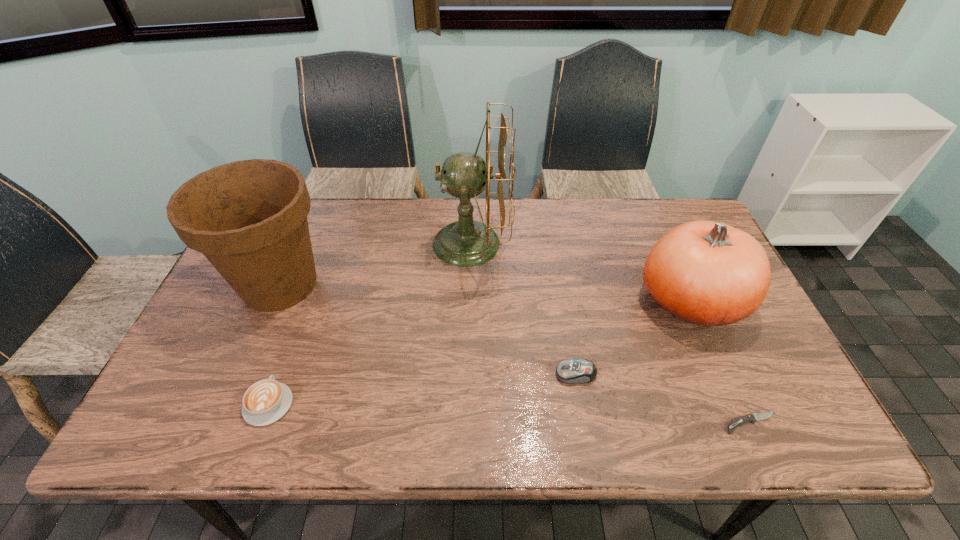
Where is `object that is positioned at the left edge`? The image size is (960, 540). object that is positioned at the left edge is located at coordinates (249, 218).

Identify the location of pumpkin present at the right edge. (706, 273).

Where is `pocketknife situated at the right edge`? Image resolution: width=960 pixels, height=540 pixels. pocketknife situated at the right edge is located at coordinates (754, 417).

Where is `object positioned at the near right corner`? object positioned at the near right corner is located at coordinates (754, 417).

This screenshot has width=960, height=540. Identify the location of vacant space at the far edge of the desktop. (617, 210).

The width and height of the screenshot is (960, 540). In the image, there is a desktop. What are the coordinates of `vacant space at the near edge` in the screenshot? It's located at (431, 429).

This screenshot has width=960, height=540. I want to click on free location at the right edge of the desktop, so click(754, 355).

Where is `unoccupied position between the flowerpot and the computer mouse`? The height and width of the screenshot is (540, 960). unoccupied position between the flowerpot and the computer mouse is located at coordinates (428, 329).

Locate an element on the screen. vacant region between the computer mouse and the flowerpot is located at coordinates (428, 329).

Where is `free space between the cappuccino and the fourth object from left to right`? This screenshot has width=960, height=540. free space between the cappuccino and the fourth object from left to right is located at coordinates (422, 389).